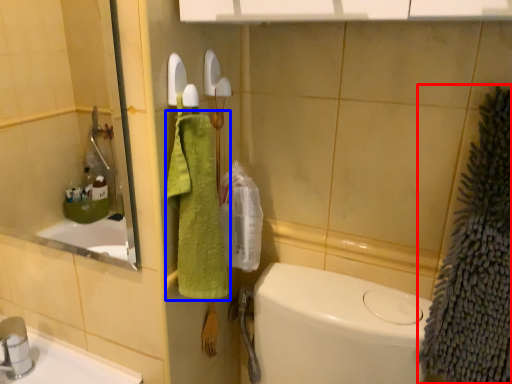
Question: Which point is closer to the camera, bath towel (highlighted by a red box) or bath towel (highlighted by a blue box)?

Choices:
 (A) bath towel
 (B) bath towel

Answer: (A)